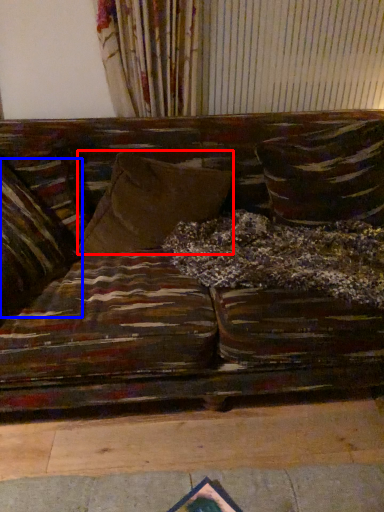
Question: Which point is further to the camera, pillow (highlighted by a red box) or pillow (highlighted by a blue box)?

Choices:
 (A) pillow
 (B) pillow

Answer: (A)